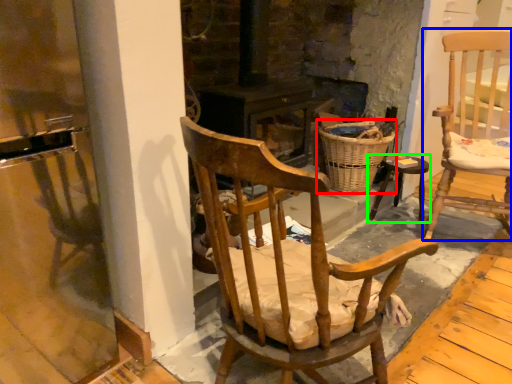
Question: Which object is positioned closest to basket (highlighted by a red box)? Select from chair (highlighted by a blue box) and stool (highlighted by a green box).

Choices:
 (A) chair
 (B) stool

Answer: (B)